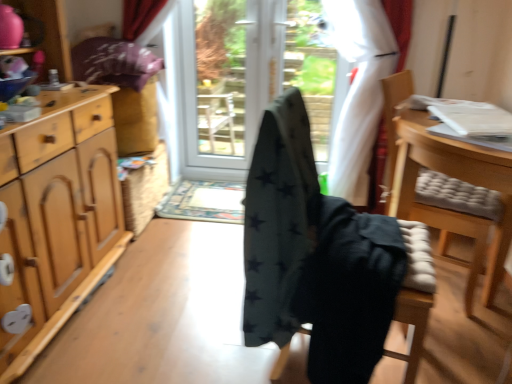
Find the location of `vacant space that is to the left of dark green fabric chair at center, positioned as the 2th chair in left-to-right order`. vacant space that is to the left of dark green fabric chair at center, positioned as the 2th chair in left-to-right order is located at coordinates 199,325.